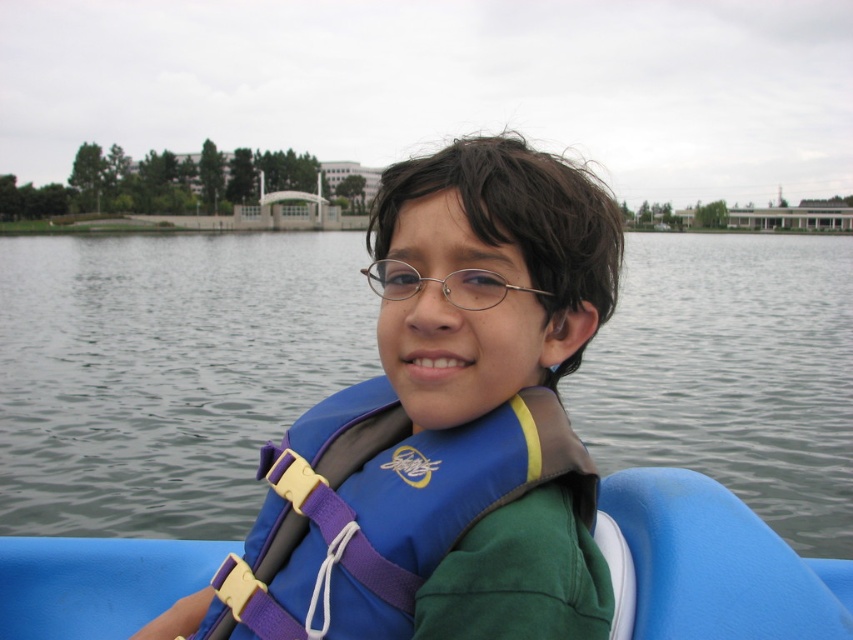
You are a safety inspector checking the placement of the blue fabric life vest at center and the gray water at center on the paddle boat. According to safety regulations, the life vest must be placed to the right of the water area. Is the current placement compliant?

The gray water at center is to the left of blue fabric life vest at center, meaning the life vest is positioned to the right of the water area, so the placement is compliant with safety regulations.

You are planning to take a photo of the gray water at center and the blue fabric life vest at center from the shore. Which object should you focus on first if you want to capture both in one shot without moving the camera?

The gray water at center is bigger than the blue fabric life vest at center, so you should focus on the gray water at center first to ensure it fills the frame appropriately before adjusting for the smaller life vest.